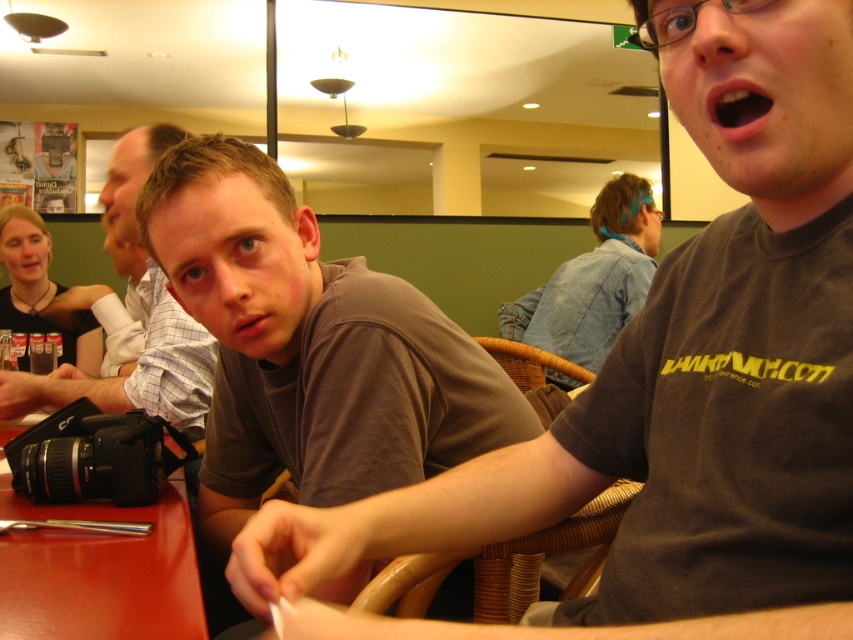
You are a server in a restaurant and need to place a new menu on the table. The menu is 12 inches wide. Can you fit it on the red plastic table at lower left without overlapping the matte gray shirt at center?

The red plastic table at lower left has a smaller size compared to matte gray shirt at center. Since the table is smaller, it might not have enough space to accommodate the 12 inch menu without overlapping the shirt. Check the table dimensions before placing the menu.

You are a server in a restaurant and need to place a 18 inch wide tray on the table. The tray is too heavy to lift again once placed. Based on the scene, can you fit the tray on the red plastic table at lower left without overlapping the matte gray shirt at center?

The red plastic table at lower left might be wider than matte gray shirt at center, so there is a possibility the tray could fit without overlapping, but there is uncertainty due to the description using the word might.

You are a photographer trying to capture a candid shot of the matte gray shirt at center and the open skin at center. Since you want to focus on both subjects equally, which one should you adjust your camera settings for to ensure proper exposure, considering their size?

The matte gray shirt at center is bigger than open skin at center, so you should adjust your camera settings to focus on the matte gray shirt at center since it takes up more space in the frame.